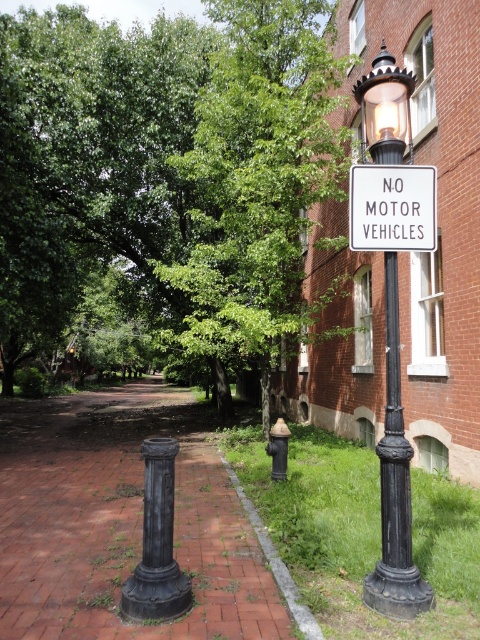
Question: Does brick pavement at center have a smaller size compared to black wrought iron lamp post at center right?

Choices:
 (A) no
 (B) yes

Answer: (A)

Question: Which point is closer to the camera?

Choices:
 (A) (396, 77)
 (B) (284, 88)

Answer: (A)

Question: Which of these objects is positioned closest to the brick pavement at center?

Choices:
 (A) matte black lamp post at upper center
 (B) black cast iron post at center

Answer: (B)

Question: Does black wrought iron lamp post at center right appear over black cast iron post at center?

Choices:
 (A) yes
 (B) no

Answer: (A)

Question: Is white plastic sign at upper center below black cast iron post at center?

Choices:
 (A) no
 (B) yes

Answer: (A)

Question: Based on their relative distances, which object is farther from the green leafy tree at upper center?

Choices:
 (A) brick pavement at center
 (B) matte black lamp post at upper center

Answer: (A)